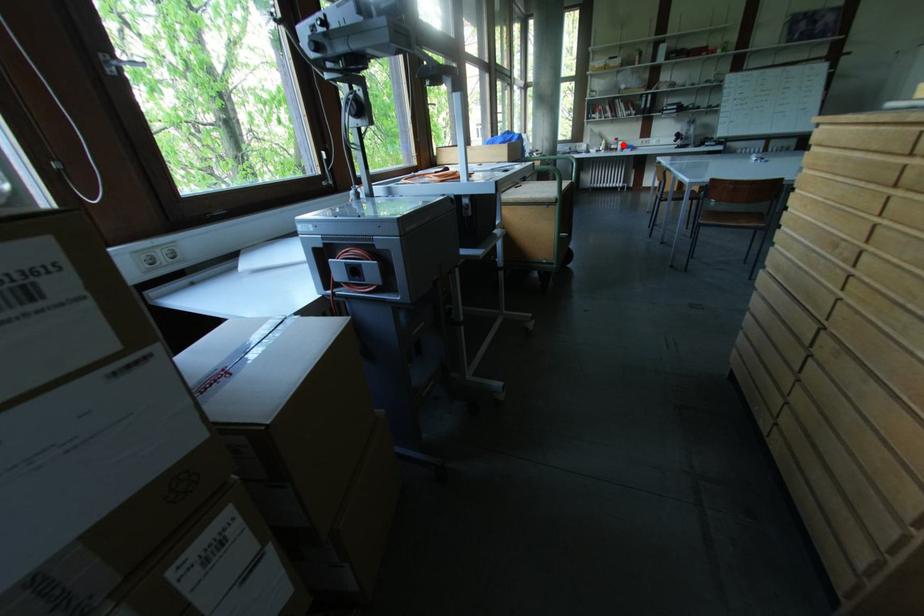
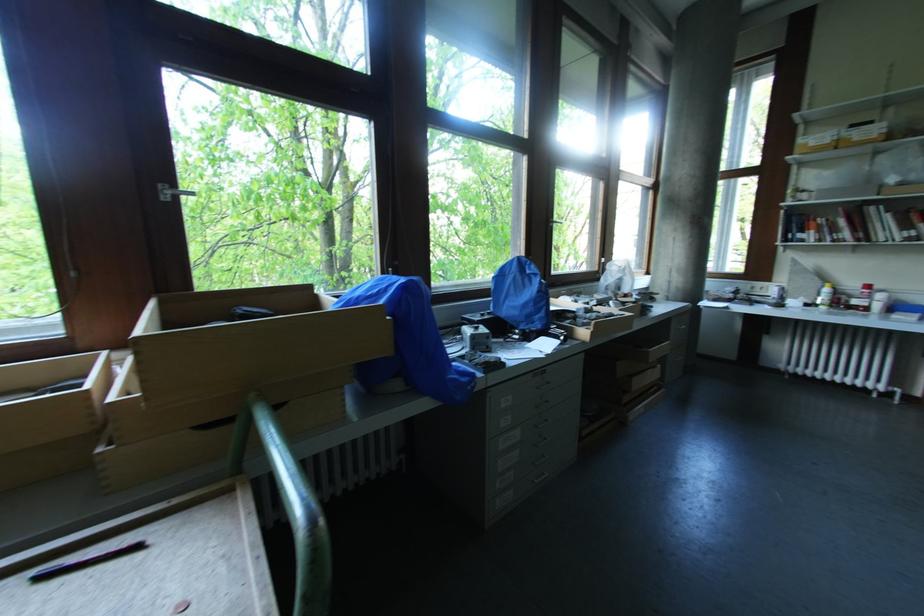
Where in the second image is the point corresponding to the highlighted location from the first image?

(882, 298)